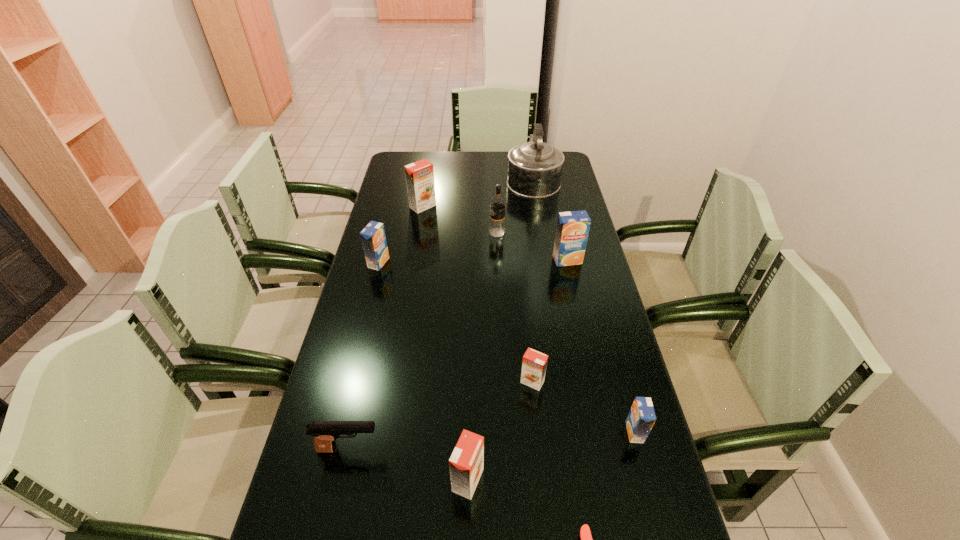
Locate an element on the screen. the nearest orange orange juice is located at coordinates (466, 464).

What are the coordinates of `the ninth farthest object` in the screenshot? It's located at (466, 464).

Locate an element on the screen. pistol is located at coordinates (325, 433).

Locate an element on the screen. The height and width of the screenshot is (540, 960). the eighth farthest object is located at coordinates (325, 433).

At what (x,y) coordinates should I click in order to perform the action: click on the second nearest orange orange juice. Please return your answer as a coordinate pair (x, y). Looking at the image, I should click on (534, 364).

Locate an element on the screen. This screenshot has width=960, height=540. the rightmost orange orange juice is located at coordinates (534, 364).

This screenshot has width=960, height=540. In order to click on the rightmost object in this screenshot , I will do `click(641, 418)`.

Locate an element on the screen. The height and width of the screenshot is (540, 960). the fourth nearest object is located at coordinates (x=641, y=418).

Locate an element on the screen. This screenshot has height=540, width=960. blank space located with the spout at the front of the farthest object is located at coordinates (528, 151).

In order to click on vacant space located 0.350m on the label of the eighth nearest object in this screenshot , I will do `click(393, 233)`.